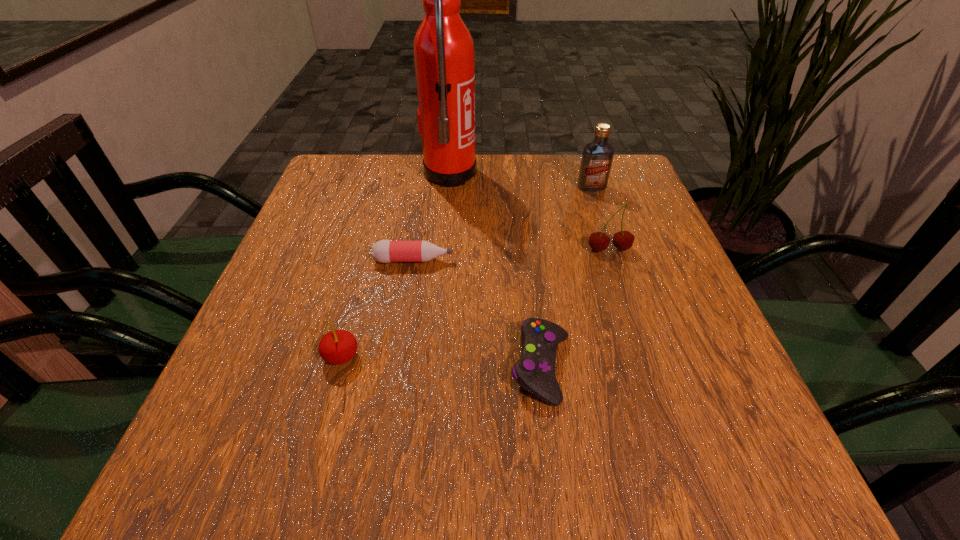
The height and width of the screenshot is (540, 960). In the image, there is a desktop. What are the coordinates of `vacant space at the left edge` in the screenshot? It's located at pos(291,328).

Where is `vacant region at the right edge of the desktop`? vacant region at the right edge of the desktop is located at coordinates (673, 351).

Identify the location of vacant area at the far left corner of the desktop. (357, 155).

The image size is (960, 540). Find the location of `free space at the near left corner`. free space at the near left corner is located at coordinates (213, 463).

Identify the location of unoccupied position between the control and the left cherry. (442, 362).

The image size is (960, 540). In order to click on empty space between the nearer cherry and the tallest object in this screenshot , I will do `click(396, 265)`.

Locate an element on the screen. This screenshot has width=960, height=540. vacant area that lies between the vodka and the nearer cherry is located at coordinates (467, 272).

Locate an element on the screen. The height and width of the screenshot is (540, 960). free space between the third object from right to left and the vodka is located at coordinates (566, 277).

You are a GUI agent. You are given a task and a screenshot of the screen. Output one action in this format:
    pyautogui.click(x=<x>, y=<y>)
    Task: Click on the vacant point located between the fourth object from left to right and the farther cherry
    
    Given the screenshot: What is the action you would take?
    pyautogui.click(x=575, y=308)

You are a GUI agent. You are given a task and a screenshot of the screen. Output one action in this format:
    pyautogui.click(x=<x>, y=<y>)
    Task: Click on the unoccupied area between the tallest object and the fifth shortest object
    This screenshot has width=960, height=540.
    Given the screenshot: What is the action you would take?
    pyautogui.click(x=520, y=181)